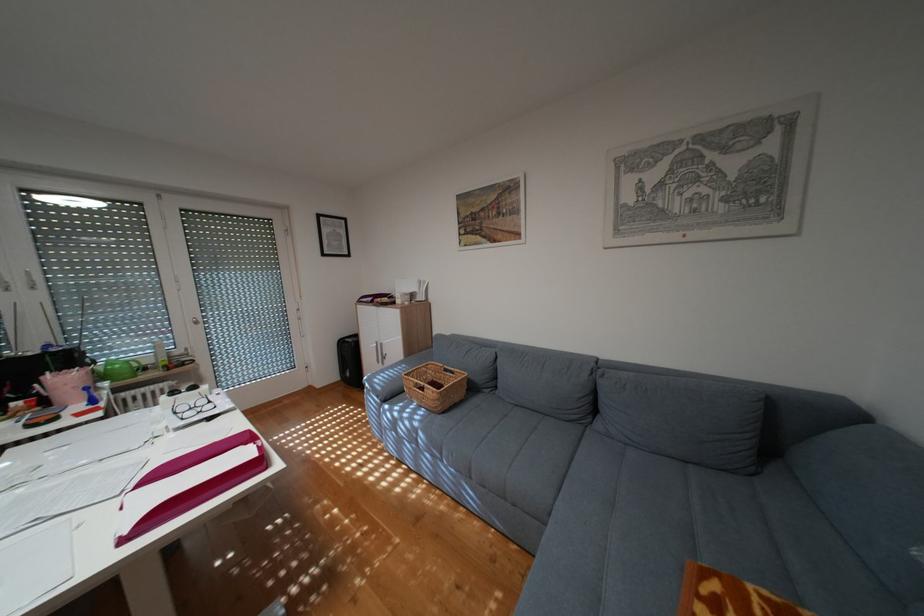
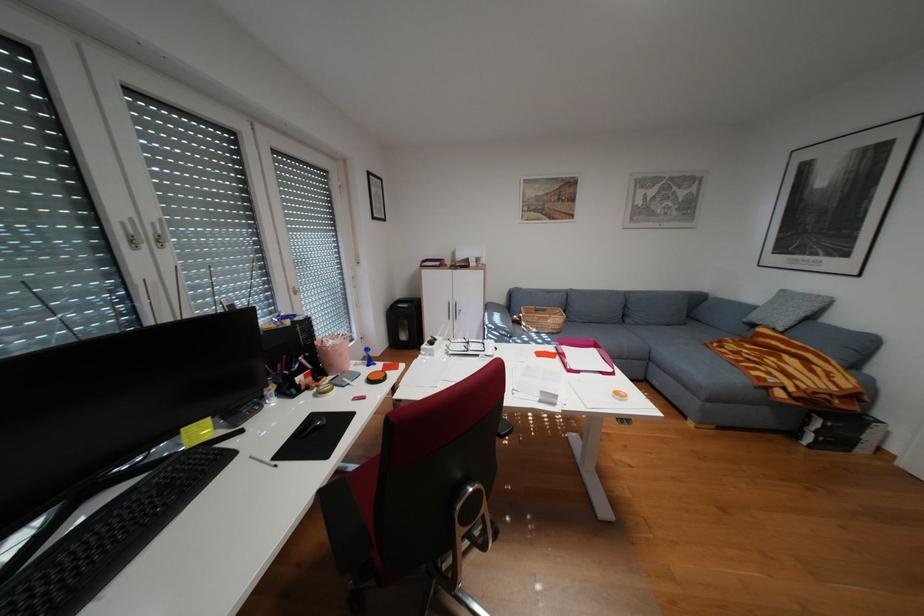
The point at (465, 371) is marked in the first image. Where is the corresponding point in the second image?

(556, 310)